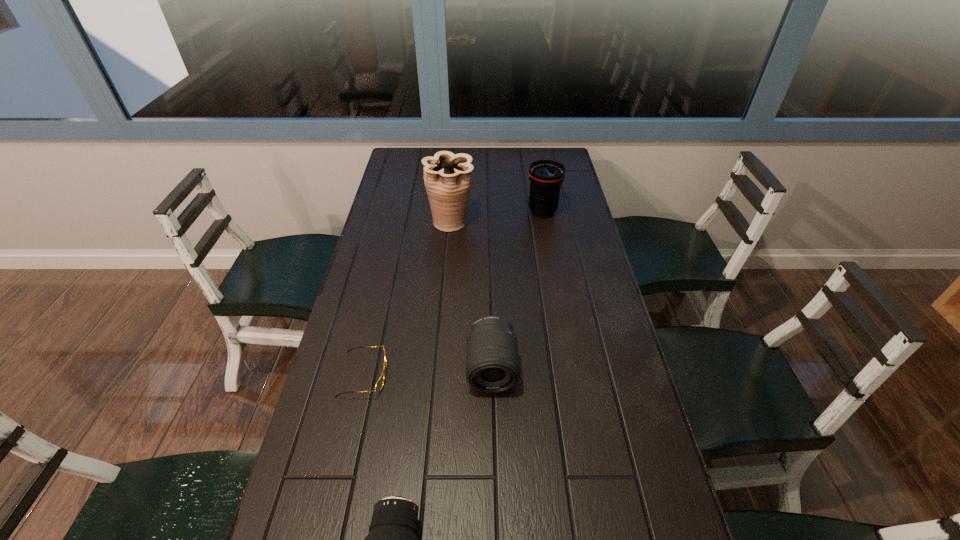
This screenshot has height=540, width=960. I want to click on vacant point located between the tallest object and the farthest telephoto lens, so click(x=496, y=217).

I want to click on empty space that is in between the rightmost object and the shortest object, so click(x=453, y=293).

Find the location of `free spot between the second telephoto lens from left to right and the rightmost telephoto lens`. free spot between the second telephoto lens from left to right and the rightmost telephoto lens is located at coordinates (517, 289).

You are a GUI agent. You are given a task and a screenshot of the screen. Output one action in this format:
    pyautogui.click(x=<x>, y=<y>)
    Task: Click on the vacant space in between the spectacles and the farthest telephoto lens
    The width and height of the screenshot is (960, 540).
    Given the screenshot: What is the action you would take?
    pyautogui.click(x=453, y=293)

What are the coordinates of `the closest object to the shortest object` in the screenshot? It's located at (492, 362).

Locate an element on the screen. The width and height of the screenshot is (960, 540). object that is the second closest to the farthest telephoto lens is located at coordinates (492, 362).

The height and width of the screenshot is (540, 960). Find the location of `telephoto lens that is the closest one to the third shortest object`. telephoto lens that is the closest one to the third shortest object is located at coordinates (392, 539).

What are the coordinates of `telephoto lens that stands as the closest to the tallest telephoto lens` in the screenshot? It's located at (492, 362).

Identify the location of vacant space that satisfies the following two spatial constraints: 1. on the front side of the rightmost telephoto lens; 2. on the front-facing side of the shortest object. (572, 375).